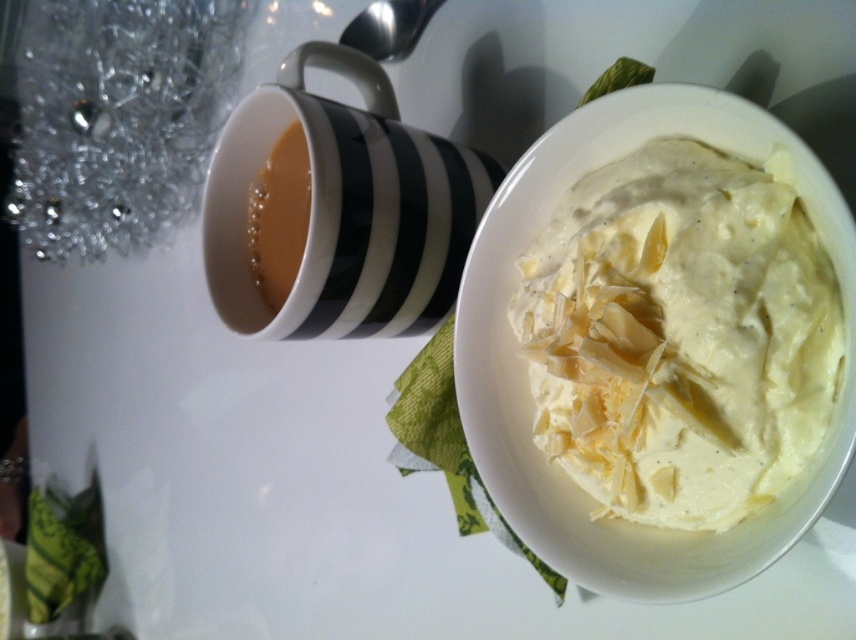
You are a barista trying to determine which item is taller between the black striped mug at upper left and the brown glossy coffee at upper left. Based on the scene, which one is taller?

The black striped mug at upper left is taller than the brown glossy coffee at upper left according to the description.

You have a small plate that is 10 inches wide. You want to place it between the white creamy pasta at center and the brown glossy coffee at upper left. Will the plate fit without overlapping either item?

The distance between the white creamy pasta at center and the brown glossy coffee at upper left is 15.26 inches. Since the plate is only 10 inches wide, there is enough space between them to place the plate without overlapping either item.

You are a photographer trying to capture the perfect shot of the white creamy pasta at center. The camera is positioned at the bottom edge of the frame. To ensure the pasta is in focus, where should you adjust the camera lens to point? Specify coordinates as a point between 0 and 1 in both x and y axes.

The white creamy pasta at center is located at coordinates point (x=681, y=336). Therefore, the camera lens should be adjusted to point at (x=681, y=336) to focus on it.